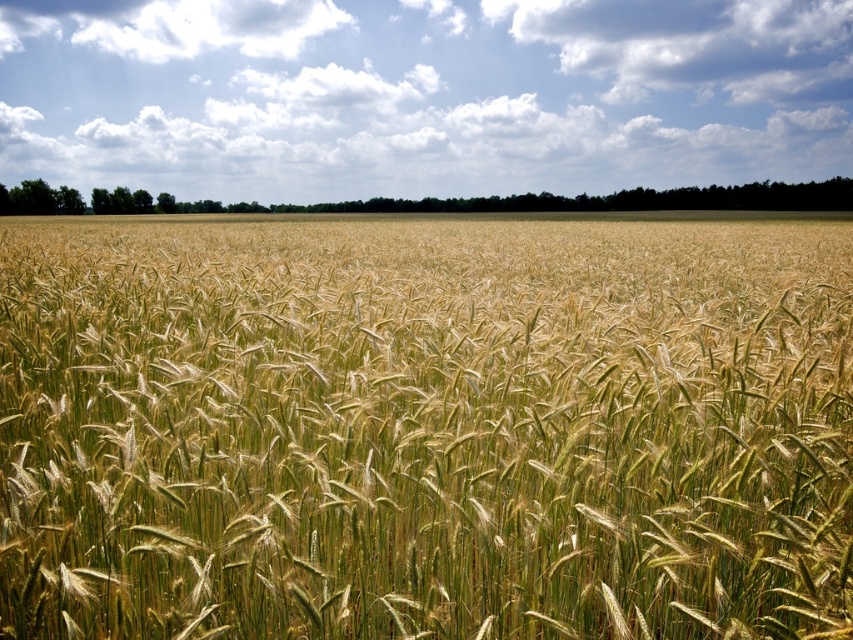
You are standing in a field and want to take a photo of the green grassy wheat at center. If your camera can focus on objects up to 10 feet away, will it be able to capture the wheat clearly?

The green grassy wheat at center is 8.45 feet away from the camera, which is within the camera focus range of up to 10 feet. Therefore, the camera can capture the wheat clearly.

You are standing in the wheat field and see two points marked in the image. Which point, point [294,460] or point [358,33], is closer to you?

Point [294,460] is closer to the camera than point [358,33], so it is closer to you.